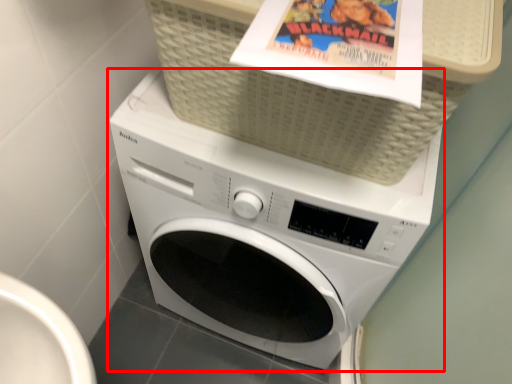
Question: From the image's perspective, where is washing machine (annotated by the red box) located in relation to basket in the image?

Choices:
 (A) below
 (B) above

Answer: (A)